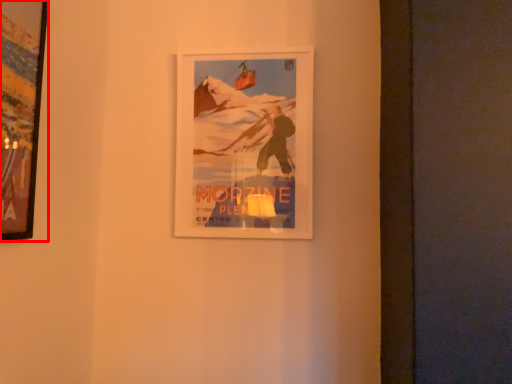
Question: From the image's perspective, what is the correct spatial positioning of picture frame (annotated by the red box) in reference to picture frame?

Choices:
 (A) below
 (B) above

Answer: (B)